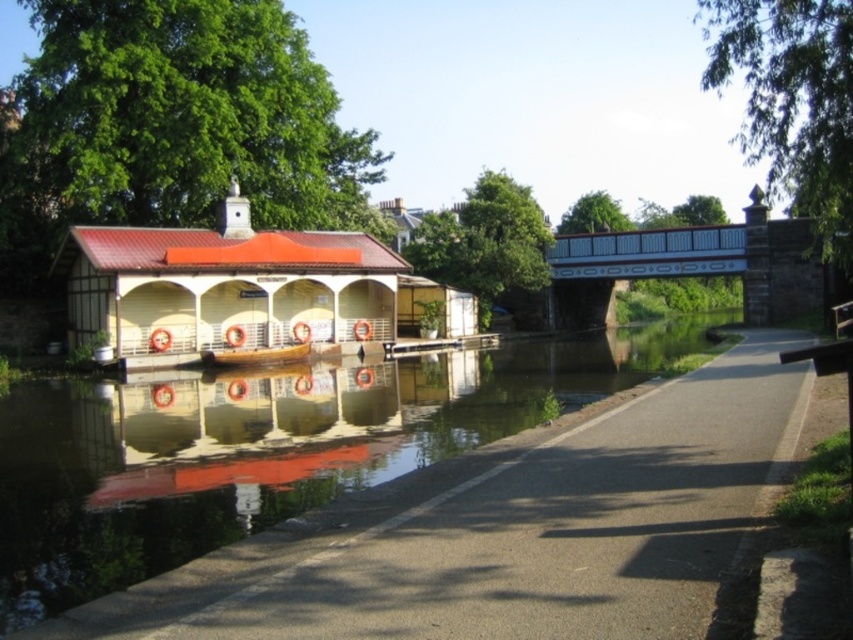
Consider the image. Does smooth concrete river at center have a greater width compared to matte white hut at left?

Correct, the width of smooth concrete river at center exceeds that of matte white hut at left.

In the scene shown: Between smooth concrete river at center and matte white hut at left, which one has more height?

With more height is matte white hut at left.

Describe the element at coordinates (265, 449) in the screenshot. The height and width of the screenshot is (640, 853). I see `smooth concrete river at center` at that location.

The width and height of the screenshot is (853, 640). What are the coordinates of `smooth concrete river at center` in the screenshot? It's located at (265, 449).

Who is taller, smooth concrete river at center or wooden boat at center?

With more height is smooth concrete river at center.

Does point (9, 547) lie in front of point (276, 362)?

Yes, it is.

Locate an element on the screen. This screenshot has width=853, height=640. smooth concrete river at center is located at coordinates (265, 449).

Is matte white hut at left bigger than wooden boat at center?

Yes, matte white hut at left is bigger than wooden boat at center.

Does point (125, 259) come closer to viewer compared to point (223, 353)?

Yes, point (125, 259) is closer to viewer.

Who is more forward, [128,353] or [263,348]?

Point [128,353]

You are a GUI agent. You are given a task and a screenshot of the screen. Output one action in this format:
    pyautogui.click(x=<x>, y=<y>)
    Task: Click on the matte white hut at left
    Image resolution: width=853 pixels, height=640 pixels.
    Given the screenshot: What is the action you would take?
    pyautogui.click(x=224, y=288)